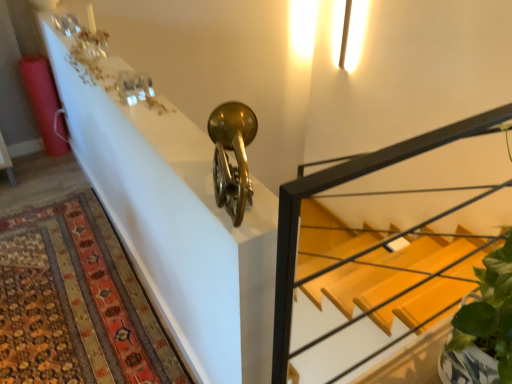
Locate an element on the screen. The image size is (512, 384). vacant region above metallic gold trumpet at upper center (from a real-world perspective) is located at coordinates (123, 89).